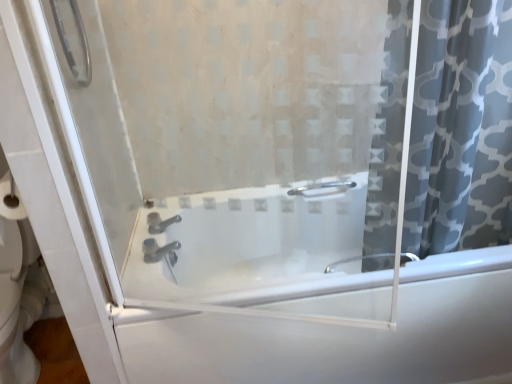
Question: Is satin nickel faucet at center aimed at white glossy bathtub at center?

Choices:
 (A) no
 (B) yes

Answer: (B)

Question: Would you say satin nickel faucet at center contains white glossy bathtub at center?

Choices:
 (A) no
 (B) yes

Answer: (A)

Question: From the image's perspective, is satin nickel faucet at center over white glossy bathtub at center?

Choices:
 (A) no
 (B) yes

Answer: (B)

Question: Can you confirm if satin nickel faucet at center is bigger than white glossy bathtub at center?

Choices:
 (A) no
 (B) yes

Answer: (A)

Question: Is satin nickel faucet at center shorter than white glossy bathtub at center?

Choices:
 (A) no
 (B) yes

Answer: (B)

Question: Does point (212, 276) appear closer or farther from the camera than point (175, 261)?

Choices:
 (A) farther
 (B) closer

Answer: (A)

Question: From the image's perspective, relative to satin nickel faucet at center, is white glossy bathtub at center above or below?

Choices:
 (A) below
 (B) above

Answer: (A)

Question: From a real-world perspective, is white glossy bathtub at center physically located above or below satin nickel faucet at center?

Choices:
 (A) above
 (B) below

Answer: (B)

Question: Based on their positions, is white glossy bathtub at center located to the left or right of satin nickel faucet at center?

Choices:
 (A) left
 (B) right

Answer: (B)

Question: Looking at the image, does gray patterned fabric at right seem bigger or smaller compared to satin nickel faucet at center?

Choices:
 (A) big
 (B) small

Answer: (A)

Question: Is gray patterned fabric at right in front of or behind satin nickel faucet at center in the image?

Choices:
 (A) behind
 (B) front

Answer: (B)

Question: From a real-world perspective, is gray patterned fabric at right physically located above or below satin nickel faucet at center?

Choices:
 (A) above
 (B) below

Answer: (A)

Question: Is gray patterned fabric at right to the left or to the right of satin nickel faucet at center in the image?

Choices:
 (A) left
 (B) right

Answer: (B)

Question: Considering the positions of satin nickel faucet at center and white glossy bathtub at center in the image, is satin nickel faucet at center taller or shorter than white glossy bathtub at center?

Choices:
 (A) tall
 (B) short

Answer: (B)

Question: Considering the positions of satin nickel faucet at center and white glossy bathtub at center in the image, is satin nickel faucet at center bigger or smaller than white glossy bathtub at center?

Choices:
 (A) small
 (B) big

Answer: (A)